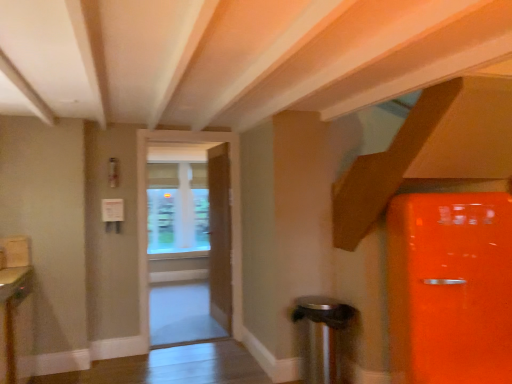
Question: Considering the relative sizes of white glossy door at center, which is counted as the second door, starting from the back, and transparent glass window at center in the image provided, is white glossy door at center, which is counted as the second door, starting from the back, smaller than transparent glass window at center?

Choices:
 (A) yes
 (B) no

Answer: (B)

Question: Does white glossy door at center, positioned as the first door in front-to-back order, turn towards transparent glass window at center?

Choices:
 (A) yes
 (B) no

Answer: (B)

Question: Considering the relative sizes of white glossy door at center, positioned as the first door in front-to-back order, and transparent glass window at center in the image provided, is white glossy door at center, positioned as the first door in front-to-back order, wider than transparent glass window at center?

Choices:
 (A) yes
 (B) no

Answer: (A)

Question: Can transparent glass window at center be found inside white glossy door at center, positioned as the first door in front-to-back order?

Choices:
 (A) no
 (B) yes

Answer: (A)

Question: From the image's perspective, is white glossy door at center, which is counted as the second door, starting from the back, located above transparent glass window at center?

Choices:
 (A) no
 (B) yes

Answer: (A)

Question: From a real-world perspective, is white glossy door at center, positioned as the first door in front-to-back order, located beneath transparent glass window at center?

Choices:
 (A) no
 (B) yes

Answer: (B)

Question: Does matte wood cabinet at lower left have a larger size compared to wooden door at center, the 1th door from the back?

Choices:
 (A) yes
 (B) no

Answer: (B)

Question: Is matte wood cabinet at lower left thinner than wooden door at center, the 1th door from the back?

Choices:
 (A) no
 (B) yes

Answer: (A)

Question: Is matte wood cabinet at lower left positioned behind wooden door at center, the 1th door from the back?

Choices:
 (A) no
 (B) yes

Answer: (A)

Question: Would you say matte wood cabinet at lower left is a long distance from wooden door at center, the 2th door when ordered from front to back?

Choices:
 (A) yes
 (B) no

Answer: (A)

Question: Can you confirm if matte wood cabinet at lower left is positioned to the right of wooden door at center, the 2th door when ordered from front to back?

Choices:
 (A) no
 (B) yes

Answer: (A)

Question: From a real-world perspective, is matte wood cabinet at lower left located higher than wooden door at center, the 2th door when ordered from front to back?

Choices:
 (A) no
 (B) yes

Answer: (A)

Question: Considering the relative sizes of wooden door at center, the 2th door when ordered from front to back, and transparent glass window at center in the image provided, is wooden door at center, the 2th door when ordered from front to back, shorter than transparent glass window at center?

Choices:
 (A) yes
 (B) no

Answer: (B)